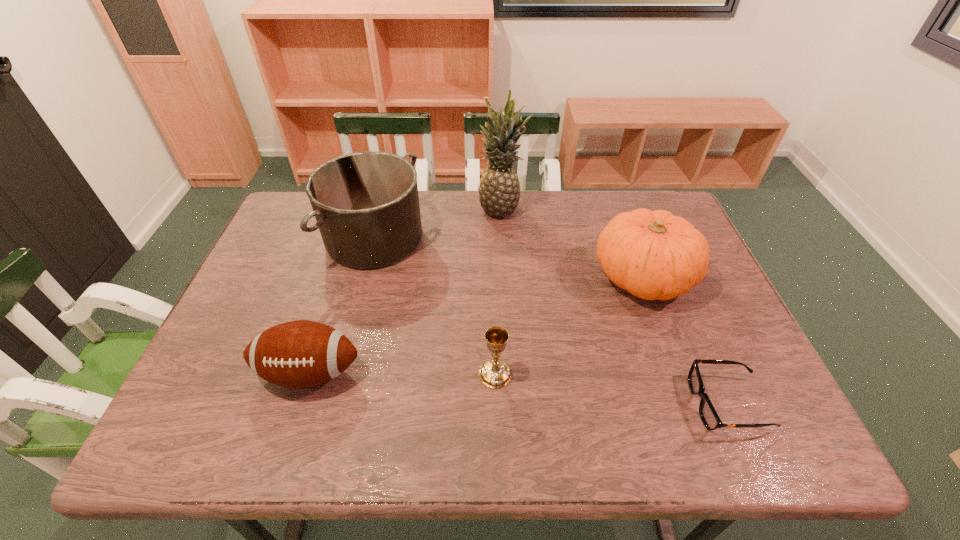
Locate an element on the screen. This screenshot has height=540, width=960. free space between the pan and the football is located at coordinates (342, 305).

Identify the location of unoccupied area between the pumpkin and the football. (476, 325).

Where is `empty location between the football and the pan`? The image size is (960, 540). empty location between the football and the pan is located at coordinates (342, 305).

The width and height of the screenshot is (960, 540). In order to click on vacant area that lies between the chalice and the pumpkin in this screenshot , I will do `click(569, 326)`.

Where is `vacant space that is in between the chalice and the pumpkin`? The width and height of the screenshot is (960, 540). vacant space that is in between the chalice and the pumpkin is located at coordinates (569, 326).

I want to click on object that is the closest to the chalice, so click(x=298, y=354).

Where is `object that is the nearest to the sunglasses`? object that is the nearest to the sunglasses is located at coordinates (654, 255).

At what (x,y) coordinates should I click in order to perform the action: click on vacant space that satisfies the following two spatial constraints: 1. on the front side of the pumpkin; 2. on the right side of the pan. Please return your answer as a coordinate pair (x, y). This screenshot has height=540, width=960. Looking at the image, I should click on (365, 277).

Where is `free space that satisfies the following two spatial constraints: 1. on the laces of the football; 2. on the right side of the chalice`? Image resolution: width=960 pixels, height=540 pixels. free space that satisfies the following two spatial constraints: 1. on the laces of the football; 2. on the right side of the chalice is located at coordinates (309, 374).